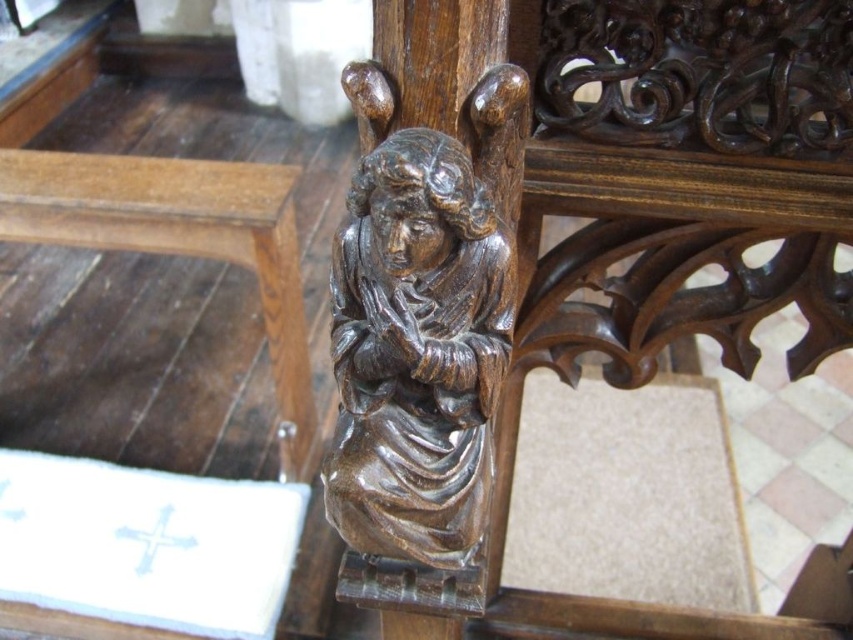
Does polished dark wood angel at center appear under brown wood table at lower left?

Correct, polished dark wood angel at center is located below brown wood table at lower left.

Can you confirm if polished dark wood angel at center is positioned to the right of brown wood table at lower left?

Indeed, polished dark wood angel at center is positioned on the right side of brown wood table at lower left.

Is point (381, 531) less distant than point (300, 401)?

Yes, it is.

At what (x,y) coordinates should I click in order to perform the action: click on polished dark wood angel at center. Please return your answer as a coordinate pair (x, y). The height and width of the screenshot is (640, 853). Looking at the image, I should click on (424, 330).